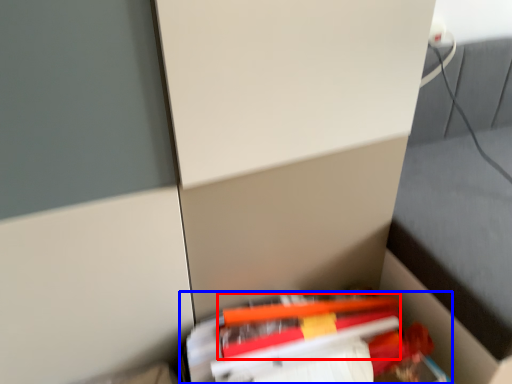
Question: Among these objects, which one is farthest to the camera, pencil (highlighted by a red box) or book (highlighted by a blue box)?

Choices:
 (A) pencil
 (B) book

Answer: (A)